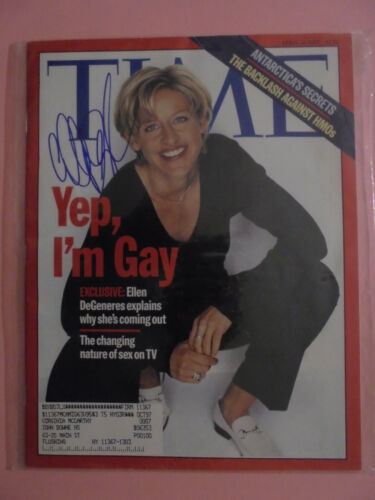
Locate an element on the screen. sock is located at coordinates (147, 393).